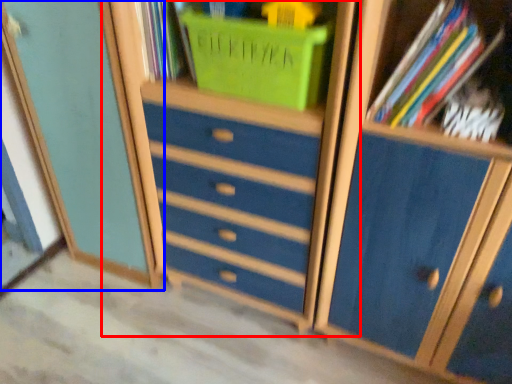
Question: Which object is further to the camera taking this photo, dresser (highlighted by a red box) or cupboard (highlighted by a blue box)?

Choices:
 (A) dresser
 (B) cupboard

Answer: (B)